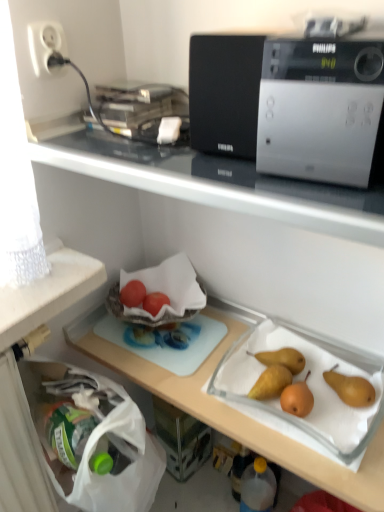
The width and height of the screenshot is (384, 512). What are the coordinates of `vacant area that is situated to the right of matte red tomato at center, the first fruit when ordered from right to left` in the screenshot? It's located at (200, 327).